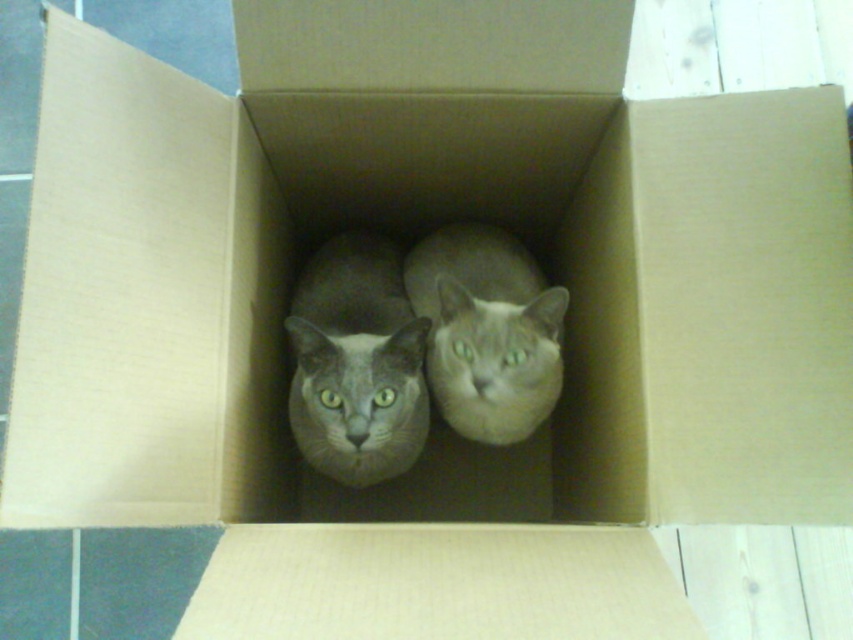
Question: Among these points, which one is farthest from the camera?

Choices:
 (A) (496, 300)
 (B) (343, 253)

Answer: (B)

Question: Is gray fur cat at center in front of gray matte cat at center?

Choices:
 (A) no
 (B) yes

Answer: (B)

Question: Which point is closer to the camera taking this photo?

Choices:
 (A) (425, 368)
 (B) (416, 445)

Answer: (B)

Question: Is gray fur cat at center below gray matte cat at center?

Choices:
 (A) no
 (B) yes

Answer: (B)

Question: Is gray fur cat at center further to camera compared to gray matte cat at center?

Choices:
 (A) no
 (B) yes

Answer: (A)